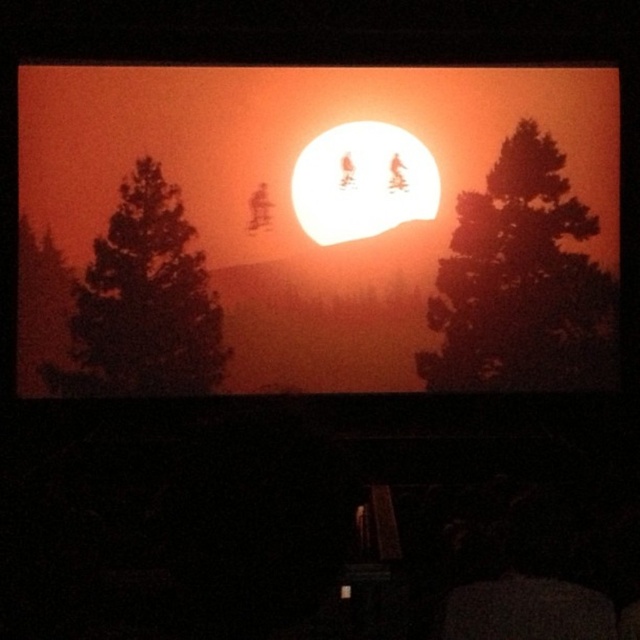
Measure the distance between matte orange sun at center and camera.

matte orange sun at center and camera are 5.80 meters apart.

Between matte orange sun at center and white matte sun at center, which one appears on the right side from the viewer's perspective?

white matte sun at center is more to the right.

Does point (280, 307) lie in front of point (392, 188)?

Yes, it is in front of point (392, 188).

Find the location of a particular element. matte orange sun at center is located at coordinates (316, 228).

Between matte orange sun at center and silhouette pine tree at left, which one is positioned higher?

matte orange sun at center is above.

Who is positioned more to the left, matte orange sun at center or silhouette pine tree at left?

silhouette pine tree at left

Where is `matte orange sun at center`? The width and height of the screenshot is (640, 640). matte orange sun at center is located at coordinates (316, 228).

Which is behind, point (504, 248) or point (176, 284)?

The point (504, 248) is more distant.

Between point (484, 186) and point (161, 387), which one is positioned in front?

Point (161, 387) is more forward.

Locate an element on the screen. Image resolution: width=640 pixels, height=640 pixels. silhouette tree at right is located at coordinates (522, 282).